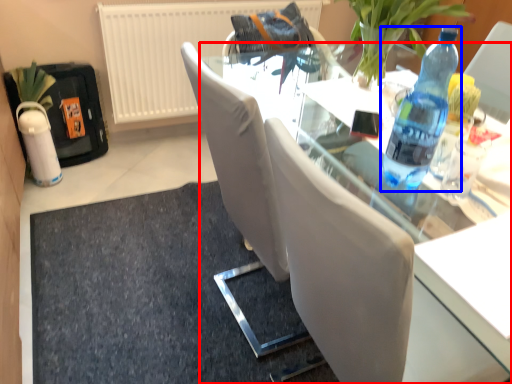
Question: Which point is further to the camera, table (highlighted by a red box) or bottle (highlighted by a blue box)?

Choices:
 (A) table
 (B) bottle

Answer: (B)